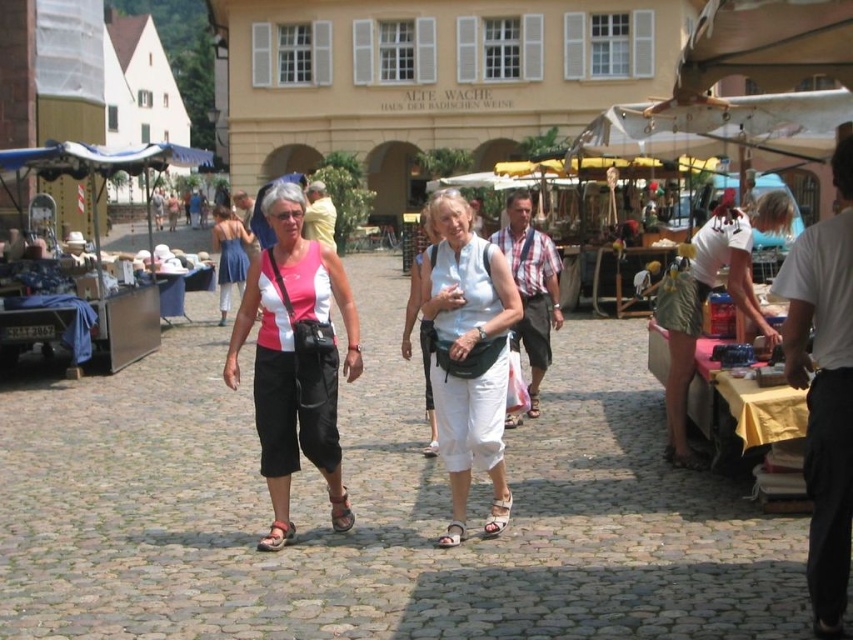
Is point (221, 288) closer to camera compared to point (339, 524)?

No, it is not.

Where is `pink fabric dress at center`? This screenshot has height=640, width=853. pink fabric dress at center is located at coordinates (229, 256).

Can you confirm if white cotton pants at center is smaller than leather sandal at center?

No.

Between white cotton pants at center and leather sandal at center, which one is positioned lower?

leather sandal at center is below.

At what (x,y) coordinates should I click in order to perform the action: click on white cotton pants at center. Please return your answer as a coordinate pair (x, y). Looking at the image, I should click on (467, 346).

Does brown leather sandal at center have a larger size compared to leather sandal at center?

Correct, brown leather sandal at center is larger in size than leather sandal at center.

From the picture: Who is more forward, [335,504] or [465,531]?

Point [465,531] is more forward.

Find the location of a particular element. This screenshot has width=853, height=640. brown leather sandal at center is located at coordinates (340, 509).